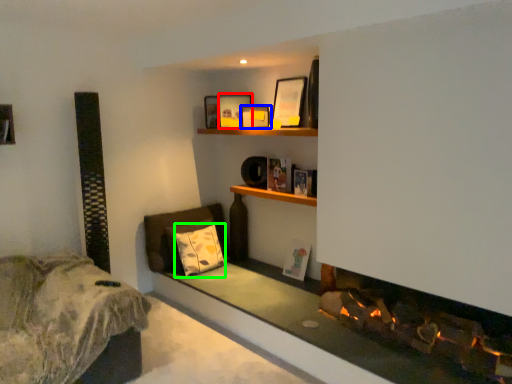
Question: Which object is positioned closest to picture frame (highlighted by a red box)? Select from picture frame (highlighted by a blue box) and pillow (highlighted by a green box).

Choices:
 (A) picture frame
 (B) pillow

Answer: (A)